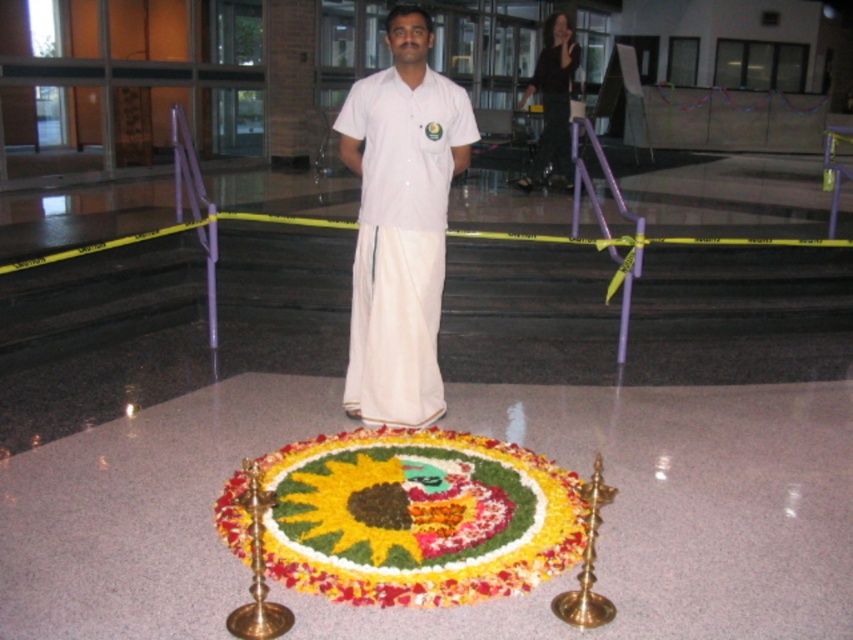
Question: In this image, where is white cotton kurta at center located relative to black silk robe at upper center?

Choices:
 (A) below
 (B) above

Answer: (A)

Question: Is white cotton kurta at center smaller than black silk robe at upper center?

Choices:
 (A) no
 (B) yes

Answer: (A)

Question: Which object is positioned closest to the white cotton kurta at center?

Choices:
 (A) floral carpet at center
 (B) black silk robe at upper center

Answer: (A)

Question: Is floral carpet at center closer to camera compared to white cotton kurta at center?

Choices:
 (A) yes
 (B) no

Answer: (A)

Question: Estimate the real-world distances between objects in this image. Which object is closer to the white cotton kurta at center?

Choices:
 (A) black silk robe at upper center
 (B) floral carpet at center

Answer: (B)

Question: Which point is closer to the camera?

Choices:
 (A) tap(378, 422)
 (B) tap(467, 509)
 (C) tap(564, 164)

Answer: (B)